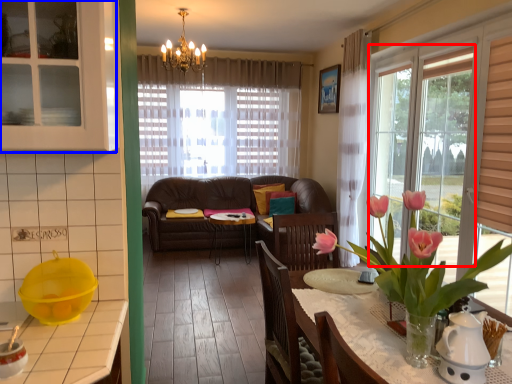
Question: Which of the following is the farthest to the observer, window (highlighted by a red box) or cabinetry (highlighted by a blue box)?

Choices:
 (A) window
 (B) cabinetry

Answer: (A)